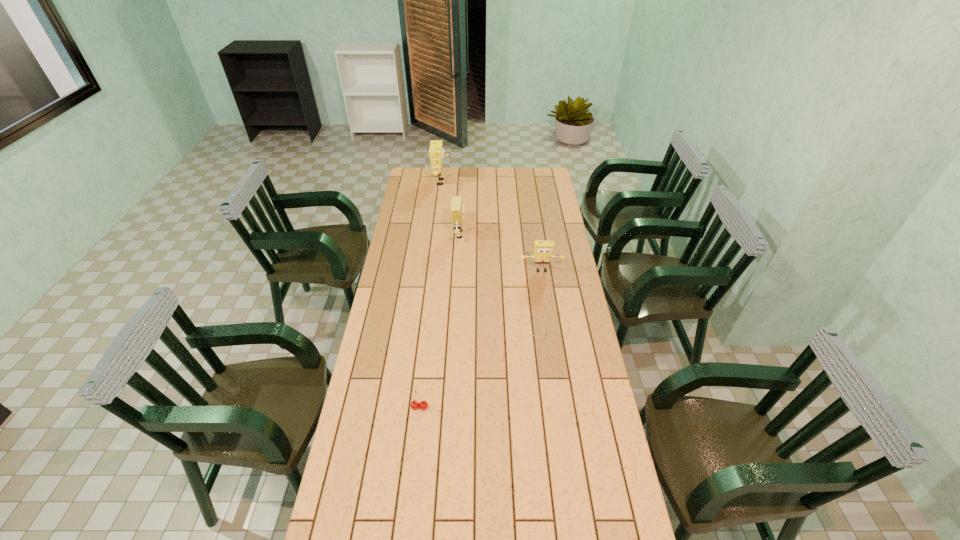
Image resolution: width=960 pixels, height=540 pixels. In order to click on free space between the second shortest object and the third nearest object in this screenshot , I will do [501, 253].

You are a GUI agent. You are given a task and a screenshot of the screen. Output one action in this format:
    pyautogui.click(x=<x>, y=<y>)
    Task: Click on the free area in between the third nearest object and the nearest object
    
    Given the screenshot: What is the action you would take?
    pyautogui.click(x=441, y=321)

The width and height of the screenshot is (960, 540). Find the location of `vacant area between the shortest sponge and the shortest object`. vacant area between the shortest sponge and the shortest object is located at coordinates (481, 339).

Identify the location of vacant area between the nearest object and the second shortest sponge. (441, 321).

Find the location of a particular element. The image size is (960, 540). empty space between the cherry and the rightmost object is located at coordinates (481, 339).

Identify the location of free spot between the shortest object and the tallest sponge. The height and width of the screenshot is (540, 960). (430, 295).

At what (x,y) coordinates should I click in order to perform the action: click on free space between the farthest object and the shortest object. Please return your answer as a coordinate pair (x, y). The height and width of the screenshot is (540, 960). Looking at the image, I should click on (430, 295).

Image resolution: width=960 pixels, height=540 pixels. In order to click on blank region between the second farthest sponge and the nearest object in this screenshot , I will do `click(441, 321)`.

Identify the location of empty space that is in between the second sponge from right to left and the nearest object. (441, 321).

Locate an element on the screen. vacant area that lies between the nearest object and the third nearest object is located at coordinates (441, 321).